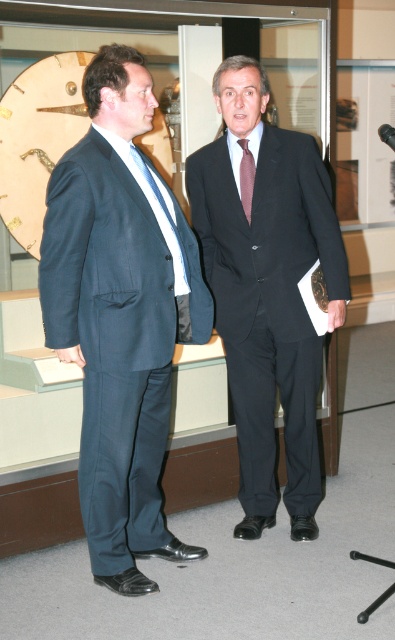
You are a photographer at a formal event and need to capture a clear photo of both the matte blue suit at left and the purple silk tie at center. Based on their positions, which object is closer to the camera?

The purple silk tie at center is closer to the camera because the matte blue suit at left is positioned under it, indicating it is behind.

You are an event planner organizing a photoshoot at this museum. You need to position a 1.8m tall camera stand between the matte blue suit at left and the purple silk tie at center. Since the camera stand must be placed closer to the taller object, where should you position it?

The matte blue suit at left is taller than the purple silk tie at center, so the camera stand should be positioned closer to the matte blue suit at left.

Looking at this image, you are a tailor measuring the distance between the black matte suit at center and the purple silk tie at center for a custom alteration. The minimum required space for proper stitching is 16 inches. Can the alteration be done as planned?

The distance between the black matte suit at center and the purple silk tie at center is 15.98 inches, which is just below the 16 inch requirement. The alteration may not be possible as planned without adjusting the measurements.